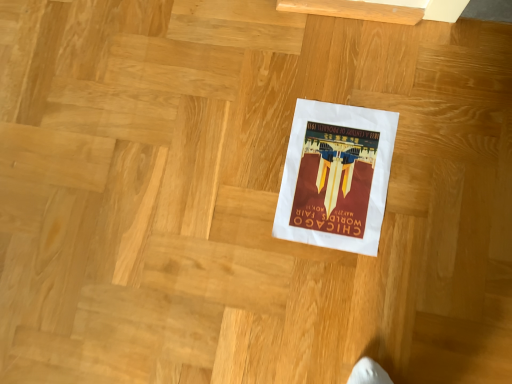
Where is `blank space to the left of white paper poster at center`? blank space to the left of white paper poster at center is located at coordinates click(241, 231).